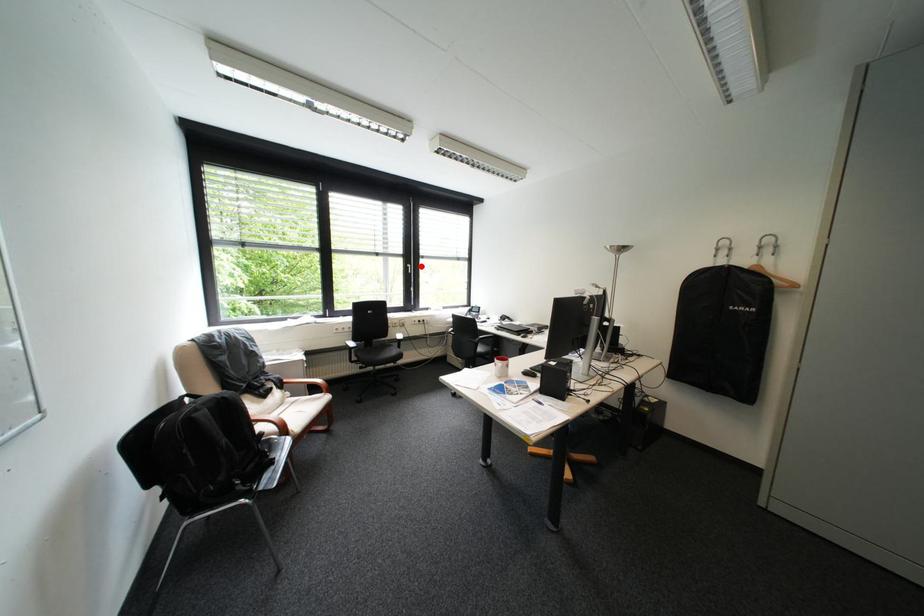
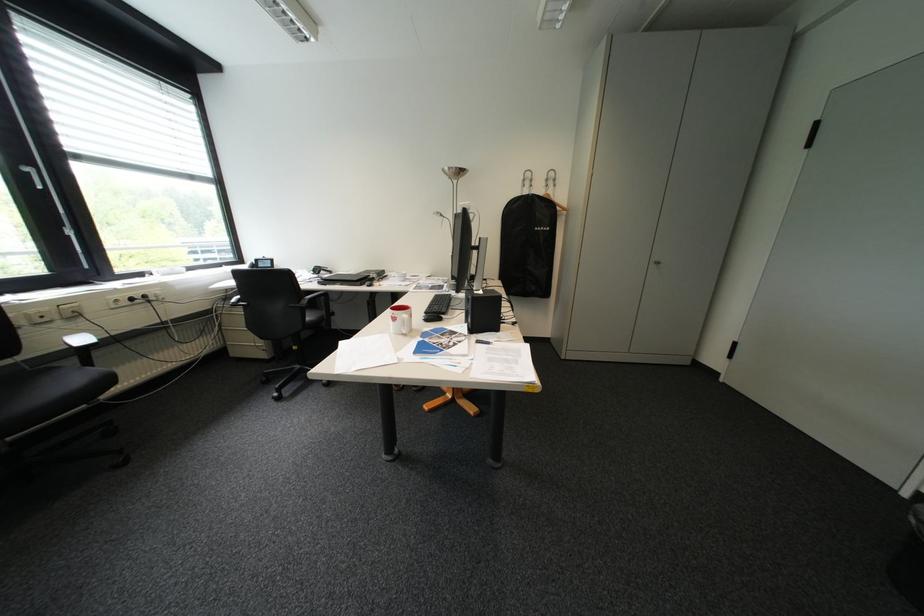
Question: A red point is marked in image1. In image2, is the corresponding 3D point closer to the camera or farther? Reply with the corresponding letter.

Choices:
 (A) The corresponding 3D point is closer.
 (B) The corresponding 3D point is farther.

Answer: (B)